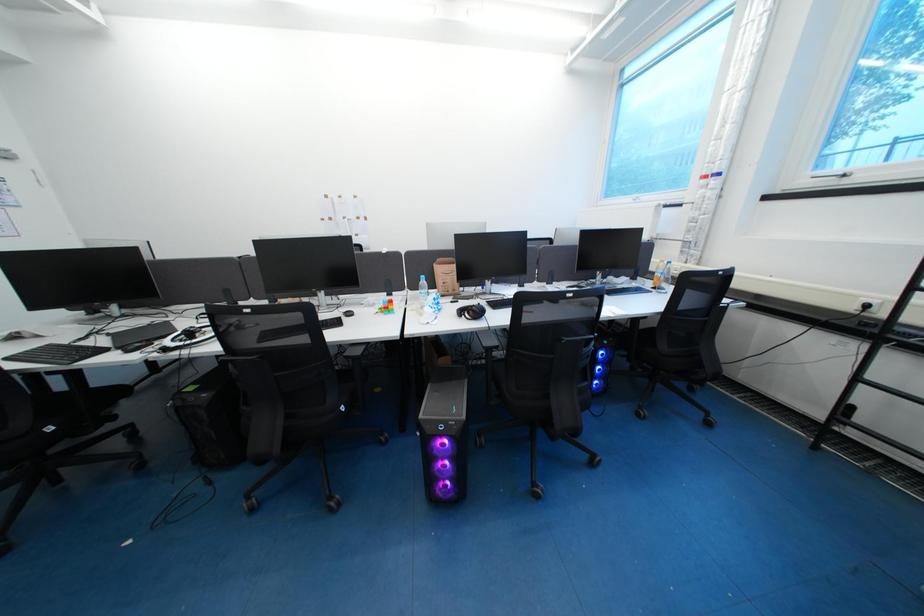
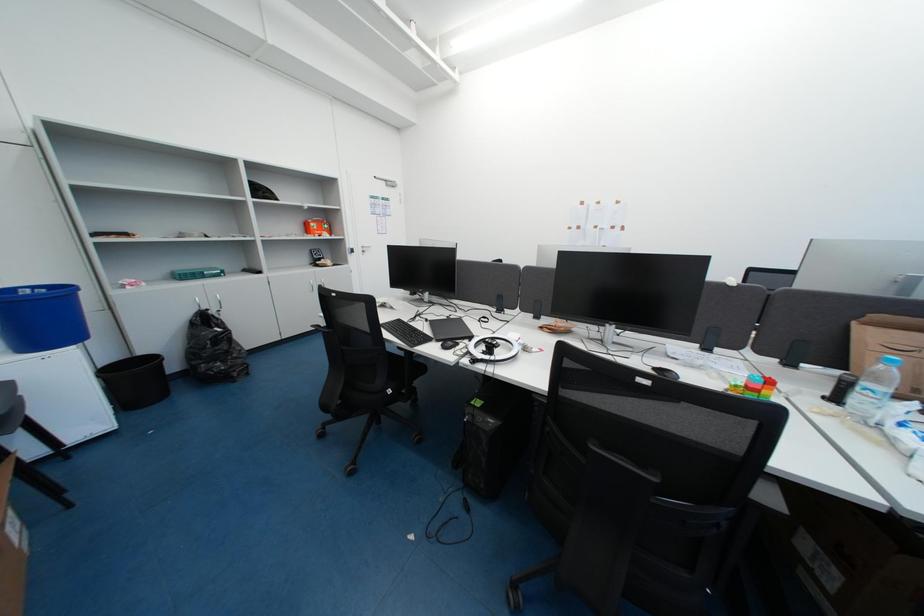
Question: The images are taken continuously from a first-person perspective. In which direction is your viewpoint rotating?

Choices:
 (A) Left
 (B) Right
 (C) Up
 (D) Down

Answer: (A)